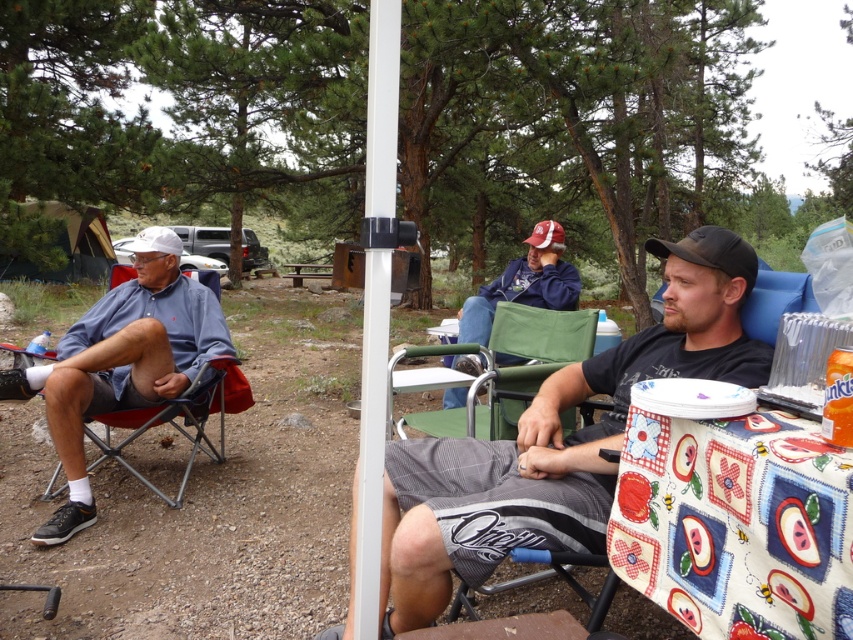
Is point (515, 444) more distant than point (410, 356)?

No, (515, 444) is closer to viewer.

Identify the location of dark gray shorts at center. The width and height of the screenshot is (853, 640). (556, 442).

Can you confirm if dark gray shorts at center is taller than matte blue shirt at left?

Incorrect, dark gray shorts at center's height is not larger of matte blue shirt at left's.

Can you confirm if dark gray shorts at center is positioned to the left of matte blue shirt at left?

In fact, dark gray shorts at center is to the right of matte blue shirt at left.

Locate an element on the screen. dark gray shorts at center is located at coordinates (556, 442).

The height and width of the screenshot is (640, 853). In order to click on floral cotton tablecloth at lower right in this screenshot , I will do `click(735, 524)`.

Locate an element on the screen. Image resolution: width=853 pixels, height=640 pixels. floral cotton tablecloth at lower right is located at coordinates (735, 524).